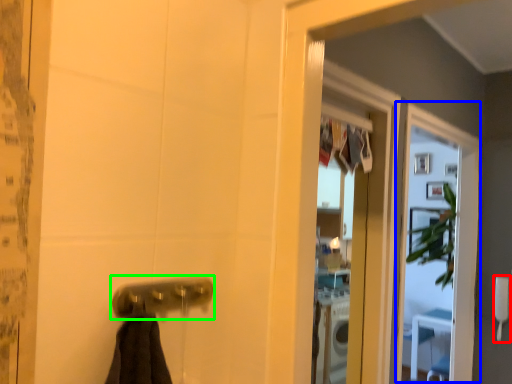
Question: Which is nearer to the towel bar (highlighted by a red box)? screen door (highlighted by a blue box) or door handle (highlighted by a green box).

Choices:
 (A) screen door
 (B) door handle

Answer: (A)